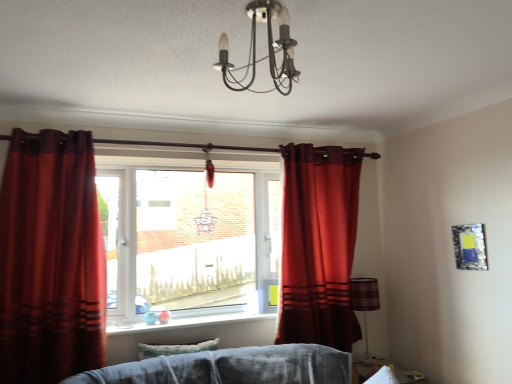
Locate an element on the screen. The image size is (512, 384). vacant space situated above smooth glass window sill at center (from a real-world perspective) is located at coordinates (183, 318).